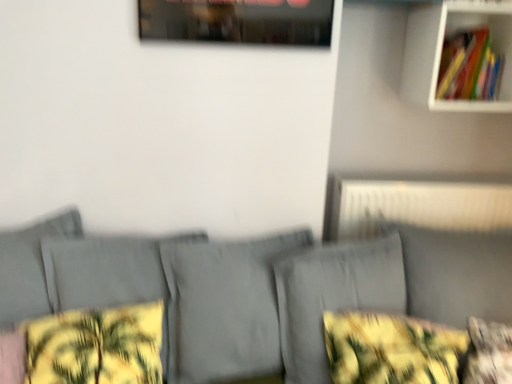
Question: Is white textured radiator at upper right not close to yellow floral fabric pillow at lower left, positioned as the 1th pillow in left-to-right order?

Choices:
 (A) no
 (B) yes

Answer: (B)

Question: From a real-world perspective, does white textured radiator at upper right stand above yellow floral fabric pillow at lower left, marked as the second pillow in a right-to-left arrangement?

Choices:
 (A) yes
 (B) no

Answer: (A)

Question: Does white textured radiator at upper right appear on the right side of yellow floral fabric pillow at lower left, positioned as the 1th pillow in left-to-right order?

Choices:
 (A) yes
 (B) no

Answer: (A)

Question: From the image's perspective, is white textured radiator at upper right located above yellow floral fabric pillow at lower left, positioned as the 1th pillow in left-to-right order?

Choices:
 (A) yes
 (B) no

Answer: (A)

Question: Does white textured radiator at upper right have a lesser height compared to yellow floral fabric pillow at lower left, marked as the second pillow in a right-to-left arrangement?

Choices:
 (A) no
 (B) yes

Answer: (A)

Question: Is white textured radiator at upper right at the left side of yellow floral fabric pillow at lower left, marked as the second pillow in a right-to-left arrangement?

Choices:
 (A) yes
 (B) no

Answer: (B)

Question: Is gray fabric couch at center inside yellow floral fabric pillow at lower right, acting as the first pillow starting from the right?

Choices:
 (A) yes
 (B) no

Answer: (B)

Question: From a real-world perspective, is yellow floral fabric pillow at lower right, acting as the first pillow starting from the right, below gray fabric couch at center?

Choices:
 (A) yes
 (B) no

Answer: (B)

Question: Is yellow floral fabric pillow at lower right, acting as the first pillow starting from the right, to the left of gray fabric couch at center from the viewer's perspective?

Choices:
 (A) no
 (B) yes

Answer: (A)

Question: Is yellow floral fabric pillow at lower right, acting as the first pillow starting from the right, taller than gray fabric couch at center?

Choices:
 (A) yes
 (B) no

Answer: (B)

Question: Is yellow floral fabric pillow at lower right, acting as the first pillow starting from the right, not close to gray fabric couch at center?

Choices:
 (A) yes
 (B) no

Answer: (B)

Question: Is yellow floral fabric pillow at lower right, arranged as the 2th pillow when viewed from the left, shorter than gray fabric couch at center?

Choices:
 (A) no
 (B) yes

Answer: (B)

Question: Is gray fabric couch at center thinner than yellow floral fabric at lower right?

Choices:
 (A) no
 (B) yes

Answer: (A)